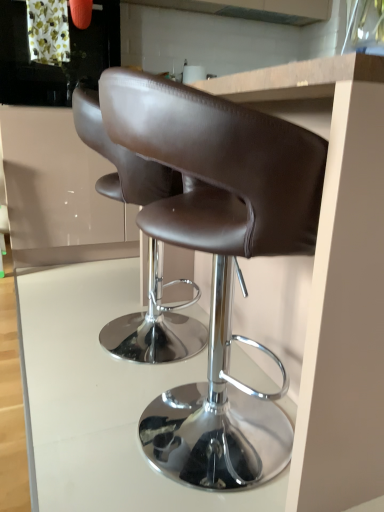
The height and width of the screenshot is (512, 384). I want to click on blank area to the left of brown leather stool at center, which is counted as the 1th chair, starting from the front, so click(x=56, y=417).